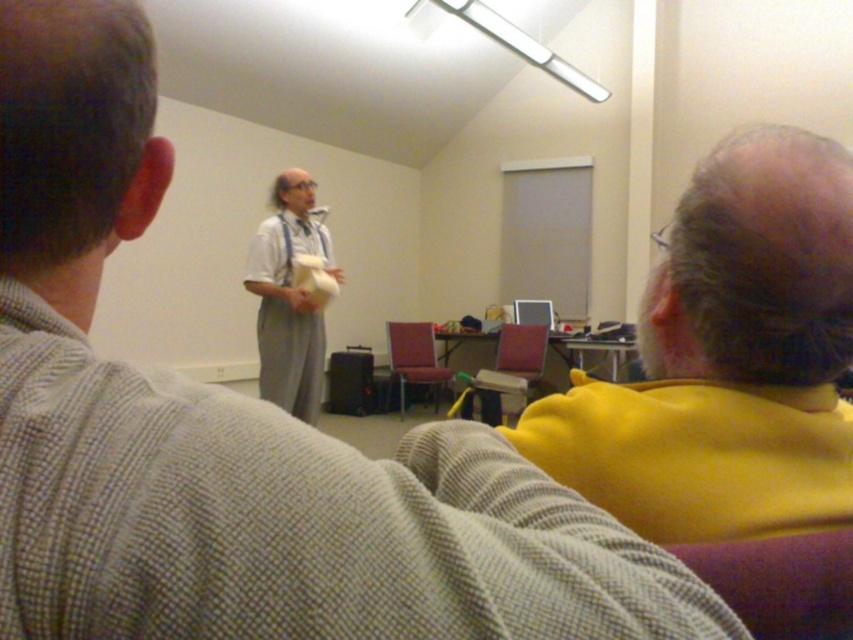
Question: Which point is closer to the camera?

Choices:
 (A) (463, 390)
 (B) (393, 380)
 (C) (834, 340)
 (D) (729, 573)

Answer: (D)

Question: Among these objects, which one is farthest from the camera?

Choices:
 (A) matte plastic chair at center
 (B) maroon fabric chair at center

Answer: (B)

Question: Which object is the closest to the maroon fabric chair at center?

Choices:
 (A) matte plastic chair at center
 (B) yellow fabric at upper right
 (C) velvet purple chair at lower right

Answer: (A)

Question: Considering the relative positions of light gray fabric dress at center and matte plastic chair at center in the image provided, where is light gray fabric dress at center located with respect to matte plastic chair at center?

Choices:
 (A) above
 (B) below

Answer: (A)

Question: Does yellow fabric at upper right appear on the right side of maroon fabric chair at center?

Choices:
 (A) yes
 (B) no

Answer: (A)

Question: Does yellow fabric at upper right appear on the right side of matte plastic chair at center?

Choices:
 (A) no
 (B) yes

Answer: (B)